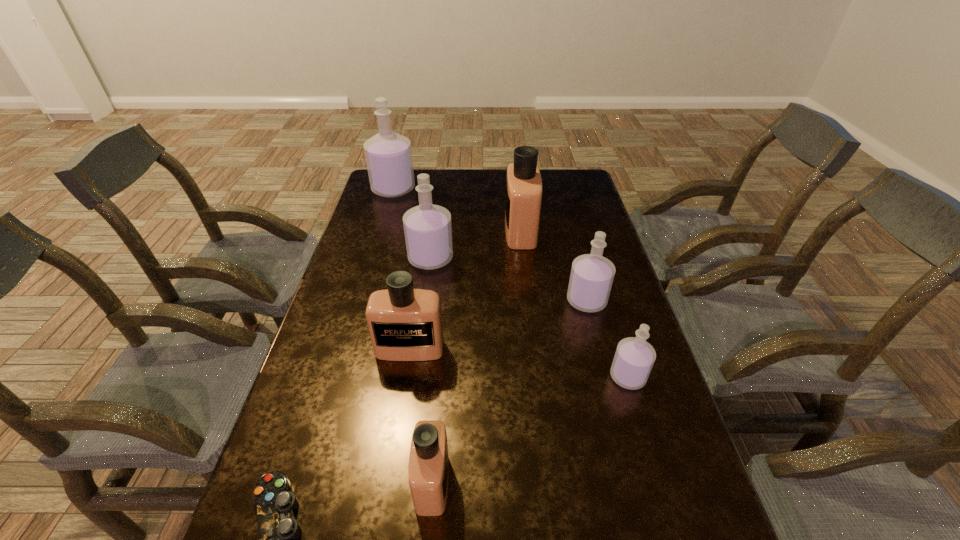
Locate an element on the screen. The image size is (960, 540). unoccupied area between the third purple perfume from right to left and the nearest perfume is located at coordinates (431, 370).

Locate an element on the screen. Image resolution: width=960 pixels, height=540 pixels. empty space that is in between the second nearest beige perfume and the leftmost purple perfume is located at coordinates (401, 269).

This screenshot has width=960, height=540. What are the coordinates of `blank region between the fourth farthest perfume and the tallest object` in the screenshot? It's located at (490, 245).

You are a GUI agent. You are given a task and a screenshot of the screen. Output one action in this format:
    pyautogui.click(x=<x>, y=<y>)
    Task: Click on the vacant point located between the third purple perfume from right to left and the sixth farthest perfume
    The height and width of the screenshot is (540, 960).
    Given the screenshot: What is the action you would take?
    pyautogui.click(x=529, y=318)

Image resolution: width=960 pixels, height=540 pixels. In order to click on free point between the second purple perfume from left to right and the second nearest perfume in this screenshot , I will do `click(529, 318)`.

Identify which object is located as the fifth nearest to the biggest purple perfume. Please provide its 2D coordinates. Your answer should be formatted as a tuple, i.e. [(x, y)], where the tuple contains the x and y coordinates of a point satisfying the conditions above.

[(634, 357)]

At what (x,y) coordinates should I click in order to perform the action: click on the second closest object relative to the third nearest object. Please return your answer as a coordinate pair (x, y). The width and height of the screenshot is (960, 540). Looking at the image, I should click on (428, 468).

Identify which perfume is the second closest to the control. Please provide its 2D coordinates. Your answer should be formatted as a tuple, i.e. [(x, y)], where the tuple contains the x and y coordinates of a point satisfying the conditions above.

[(405, 324)]

The width and height of the screenshot is (960, 540). I want to click on perfume that stands as the third closest to the nearest perfume, so click(x=591, y=278).

I want to click on purple perfume identified as the closest to the fourth nearest object, so click(428, 232).